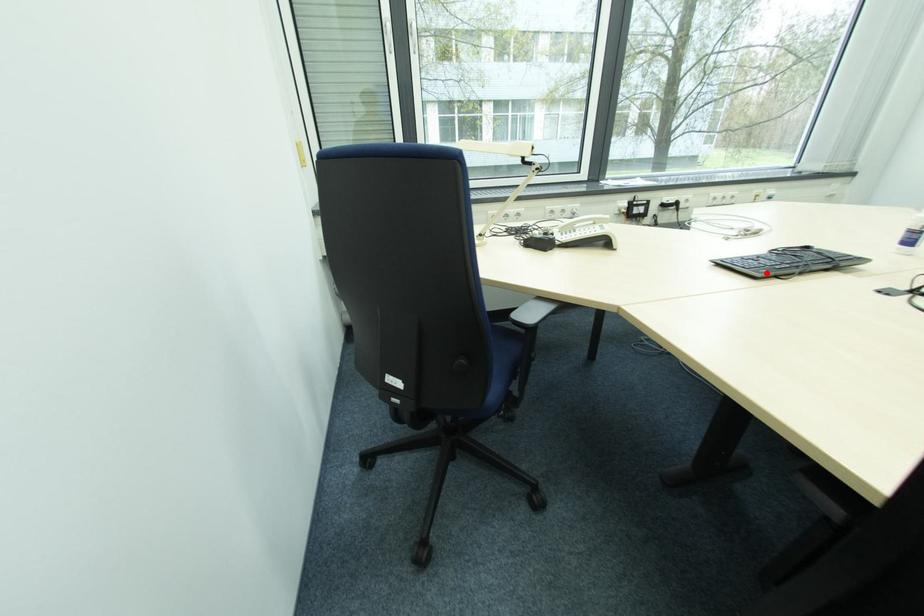
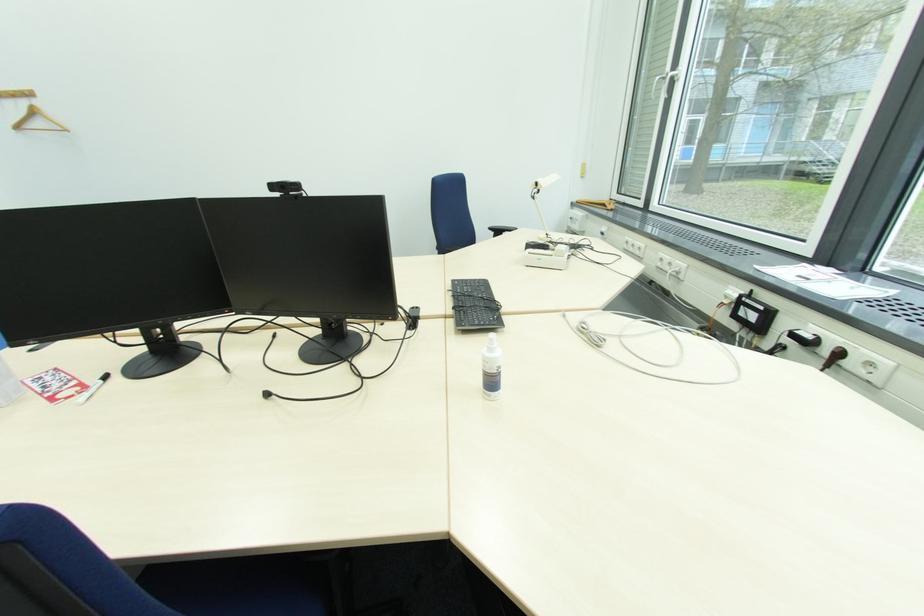
The point at the highlighted location is marked in the first image. Where is the corresponding point in the second image?

(459, 285)